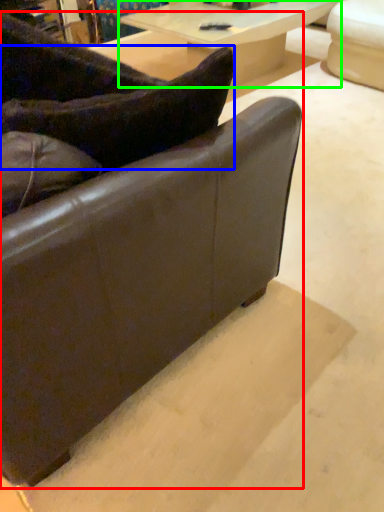
Question: Which is farther away from studio couch (highlighted by a red box)? pillow (highlighted by a blue box) or table (highlighted by a green box)?

Choices:
 (A) pillow
 (B) table

Answer: (B)